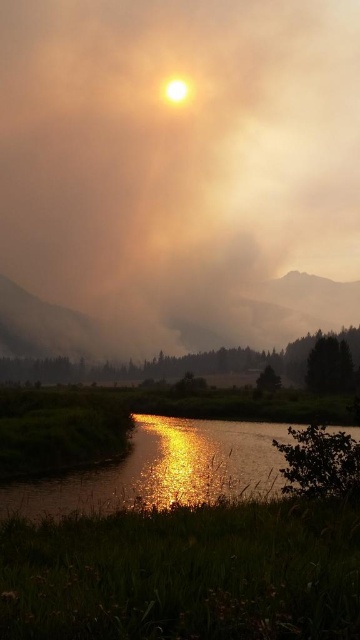
Looking at this image, does foggy smoke at upper center have a greater width compared to shiny reflective water at lower center?

Indeed, foggy smoke at upper center has a greater width compared to shiny reflective water at lower center.

Between foggy smoke at upper center and shiny reflective water at lower center, which one is positioned lower?

shiny reflective water at lower center

Is point (129, 51) farther from camera compared to point (177, 496)?

Yes.

The height and width of the screenshot is (640, 360). I want to click on foggy smoke at upper center, so click(x=177, y=173).